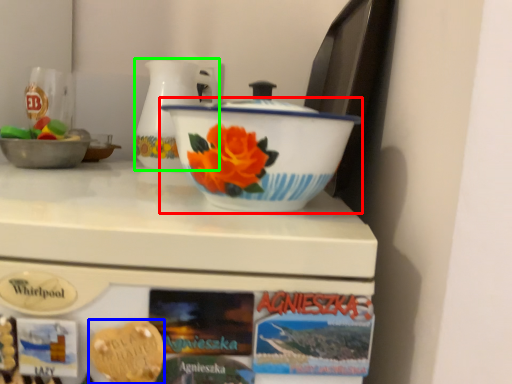
Question: Based on their relative distances, which object is farther from basin (highlighted by a red box)? Choose from food (highlighted by a blue box) and jug (highlighted by a green box).

Choices:
 (A) food
 (B) jug

Answer: (B)